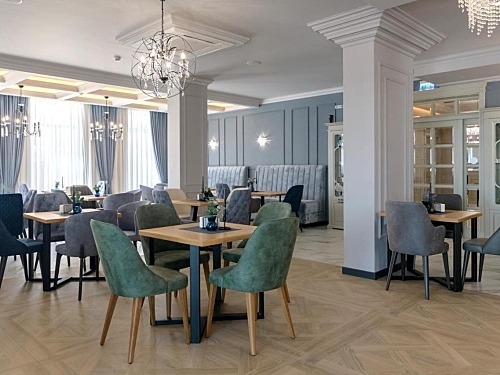
Image resolution: width=500 pixels, height=375 pixels. I want to click on green chairs in image, so click(x=118, y=275), click(x=262, y=254), click(x=273, y=209), click(x=151, y=218).